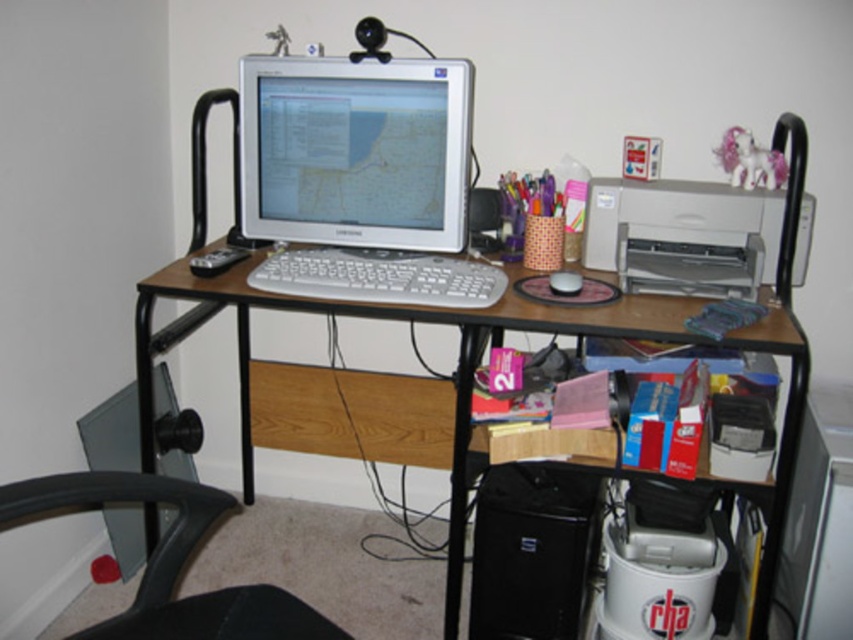
Which is above, silver metallic monitor at center or white plastic keyboard at center?

silver metallic monitor at center is above.

Can you confirm if silver metallic monitor at center is shorter than white plastic keyboard at center?

In fact, silver metallic monitor at center may be taller than white plastic keyboard at center.

Find the location of a particular element. This screenshot has height=640, width=853. silver metallic monitor at center is located at coordinates (355, 150).

The height and width of the screenshot is (640, 853). What do you see at coordinates (171, 563) in the screenshot?
I see `black plastic swivel chair at lower left` at bounding box center [171, 563].

Who is positioned more to the right, black plastic swivel chair at lower left or white plastic keyboard at center?

Positioned to the right is white plastic keyboard at center.

What are the coordinates of `black plastic swivel chair at lower left` in the screenshot? It's located at (171, 563).

Can you confirm if brown wooden table at center is thinner than white matte mouse at center?

No.

Does brown wooden table at center have a larger size compared to white matte mouse at center?

Indeed, brown wooden table at center has a larger size compared to white matte mouse at center.

Locate an element on the screen. brown wooden table at center is located at coordinates (380, 317).